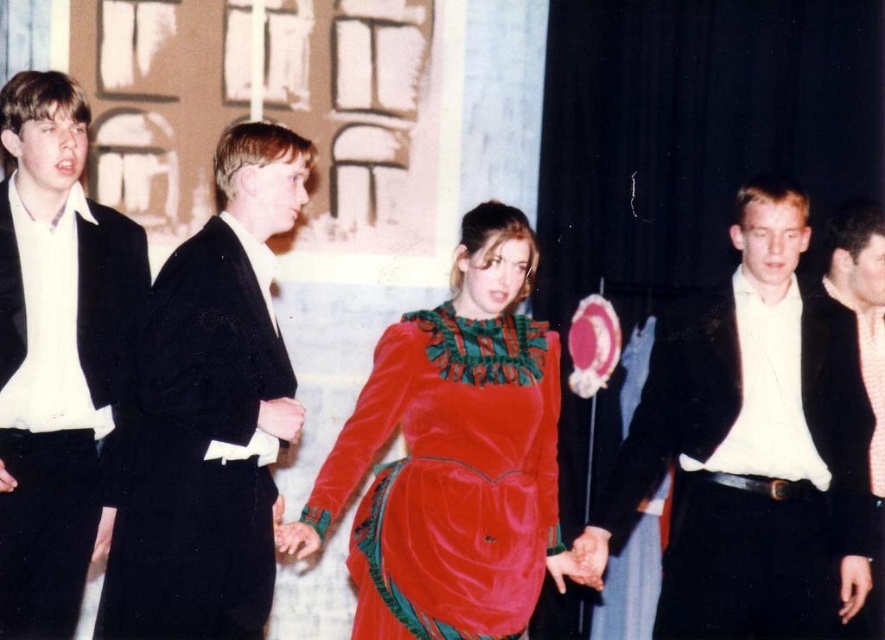
Based on the photo, who is lower down, velvet black suit at left or matte black suit at right?

Positioned lower is velvet black suit at left.

You are a GUI agent. You are given a task and a screenshot of the screen. Output one action in this format:
    pyautogui.click(x=<x>, y=<y>)
    Task: Click on the velvet black suit at left
    Image resolution: width=885 pixels, height=640 pixels.
    Given the screenshot: What is the action you would take?
    pyautogui.click(x=55, y=349)

At what (x,y) coordinates should I click in order to perform the action: click on velvet black suit at left. Please return your answer as a coordinate pair (x, y). Image resolution: width=885 pixels, height=640 pixels. Looking at the image, I should click on (55, 349).

Is velvet dress at center thinner than velvet black suit at center?

No, velvet dress at center is not thinner than velvet black suit at center.

Is point (531, 577) farther from camera compared to point (220, 476)?

Yes.

You are a GUI agent. You are given a task and a screenshot of the screen. Output one action in this format:
    pyautogui.click(x=<x>, y=<y>)
    Task: Click on the velvet dress at center
    Image resolution: width=885 pixels, height=640 pixels.
    Given the screenshot: What is the action you would take?
    pyautogui.click(x=453, y=456)

Does shiny black suit at right appear on the right side of velvet black suit at left?

Indeed, shiny black suit at right is positioned on the right side of velvet black suit at left.

Which is below, shiny black suit at right or velvet black suit at left?

shiny black suit at right is below.

Is point (740, 358) positioned in front of point (21, 240)?

Yes.

What are the coordinates of `shiny black suit at right` in the screenshot? It's located at (752, 445).